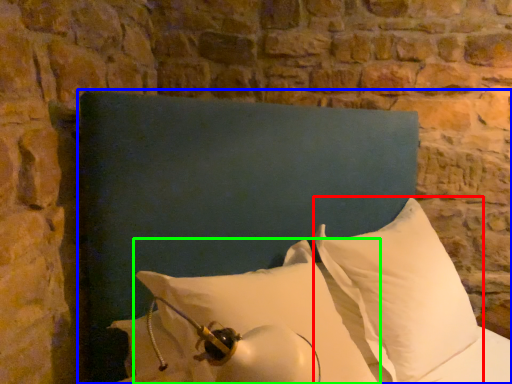
Question: Estimate the real-world distances between objects in this image. Which object is farther from pillow (highlighted by a red box), furniture (highlighted by a blue box) or pillow (highlighted by a green box)?

Choices:
 (A) furniture
 (B) pillow

Answer: (A)